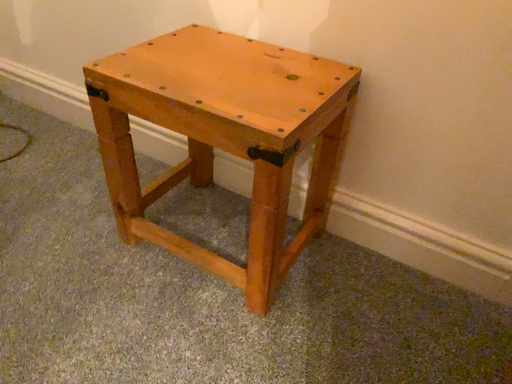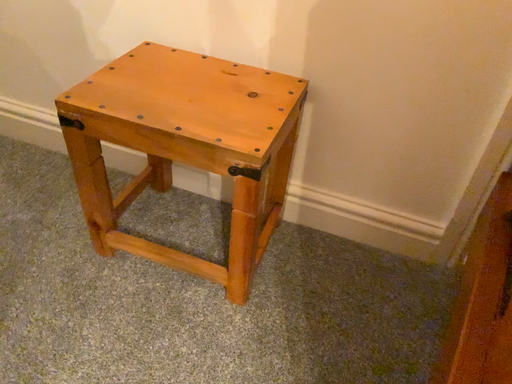
Question: Which way did the camera rotate in the video?

Choices:
 (A) rotated left
 (B) rotated right

Answer: (B)